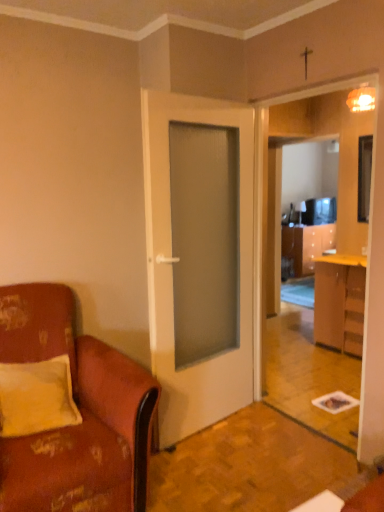
Question: From the image's perspective, is wooden cabinet at right on top of yellow fabric pillow at left?

Choices:
 (A) no
 (B) yes

Answer: (B)

Question: Does wooden cabinet at right appear on the right side of yellow fabric pillow at left?

Choices:
 (A) yes
 (B) no

Answer: (A)

Question: Is wooden cabinet at right beside yellow fabric pillow at left?

Choices:
 (A) yes
 (B) no

Answer: (B)

Question: Would you say yellow fabric pillow at left is part of wooden cabinet at right's contents?

Choices:
 (A) no
 (B) yes

Answer: (A)

Question: From a real-world perspective, is wooden cabinet at right over yellow fabric pillow at left?

Choices:
 (A) no
 (B) yes

Answer: (A)

Question: Considering the relative sizes of wooden cabinet at right and yellow fabric pillow at left in the image provided, is wooden cabinet at right bigger than yellow fabric pillow at left?

Choices:
 (A) no
 (B) yes

Answer: (B)

Question: Is white matte door at center further to the viewer compared to leather at left?

Choices:
 (A) yes
 (B) no

Answer: (A)

Question: From a real-world perspective, is white matte door at center positioned over leather at left based on gravity?

Choices:
 (A) no
 (B) yes

Answer: (B)

Question: Are white matte door at center and leather at left making contact?

Choices:
 (A) no
 (B) yes

Answer: (A)

Question: Does white matte door at center appear on the right side of leather at left?

Choices:
 (A) no
 (B) yes

Answer: (B)

Question: Is white matte door at center in front of leather at left?

Choices:
 (A) no
 (B) yes

Answer: (A)

Question: Is white matte door at center shorter than leather at left?

Choices:
 (A) yes
 (B) no

Answer: (B)

Question: Does black glossy television at right come in front of white matte door at center?

Choices:
 (A) no
 (B) yes

Answer: (A)